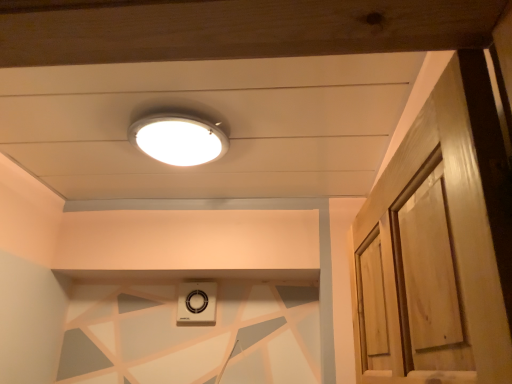
What do you see at coordinates (178, 139) in the screenshot? I see `white glossy lamp at upper center` at bounding box center [178, 139].

Where is `white glossy lamp at upper center`? The height and width of the screenshot is (384, 512). white glossy lamp at upper center is located at coordinates (178, 139).

This screenshot has height=384, width=512. I want to click on white plastic vent at lower center, so click(x=197, y=302).

What do you see at coordinates (197, 302) in the screenshot?
I see `white plastic vent at lower center` at bounding box center [197, 302].

The height and width of the screenshot is (384, 512). What are the coordinates of `white glossy lamp at upper center` in the screenshot? It's located at (178, 139).

Between white plastic vent at lower center and white glossy lamp at upper center, which one appears on the left side from the viewer's perspective?

Positioned to the left is white plastic vent at lower center.

Is the depth of white plastic vent at lower center greater than that of white glossy lamp at upper center?

Yes, white plastic vent at lower center is further from the camera.

Is point (207, 293) positioned in front of point (168, 150)?

No, it is behind (168, 150).

From the image's perspective, is white plastic vent at lower center on top of white glossy lamp at upper center?

No.

From a real-world perspective, which object rests below the other?

white plastic vent at lower center.

Considering the relative sizes of white plastic vent at lower center and white glossy lamp at upper center in the image provided, is white plastic vent at lower center wider than white glossy lamp at upper center?

Incorrect, the width of white plastic vent at lower center does not surpass that of white glossy lamp at upper center.

Is white plastic vent at lower center shorter than white glossy lamp at upper center?

In fact, white plastic vent at lower center may be taller than white glossy lamp at upper center.

Considering the sizes of objects white plastic vent at lower center and white glossy lamp at upper center in the image provided, who is smaller, white plastic vent at lower center or white glossy lamp at upper center?

With smaller size is white plastic vent at lower center.

Would you say white plastic vent at lower center is outside white glossy lamp at upper center?

Yes.

Is white plastic vent at lower center far from white glossy lamp at upper center?

That's not correct — white plastic vent at lower center is a little close to white glossy lamp at upper center.

Is white plastic vent at lower center oriented away from white glossy lamp at upper center?

Answer: No, white plastic vent at lower center's orientation is not away from white glossy lamp at upper center.

How different are the orientations of white plastic vent at lower center and white glossy lamp at upper center in degrees?

0.234 degrees separate the facing orientations of white plastic vent at lower center and white glossy lamp at upper center.

Locate an element on the screen. lamp located above the white plastic vent at lower center (from the image's perspective) is located at coordinates [x=178, y=139].

Is white glossy lamp at upper center to the right of white plastic vent at lower center from the viewer's perspective?

Correct, you'll find white glossy lamp at upper center to the right of white plastic vent at lower center.

Between white glossy lamp at upper center and white plastic vent at lower center, which one is positioned behind?

white plastic vent at lower center is more distant.

Is point (168, 118) closer or farther from the camera than point (202, 301)?

Point (168, 118) is closer to the camera than point (202, 301).

From the image's perspective, between white glossy lamp at upper center and white plastic vent at lower center, who is located below?

From the image's view, white plastic vent at lower center is below.

From a real-world perspective, is white glossy lamp at upper center above or below white plastic vent at lower center?

white glossy lamp at upper center is situated higher than white plastic vent at lower center in the real world.

In terms of width, does white glossy lamp at upper center look wider or thinner when compared to white plastic vent at lower center?

white glossy lamp at upper center is wider than white plastic vent at lower center.

Can you confirm if white glossy lamp at upper center is taller than white plastic vent at lower center?

Incorrect, the height of white glossy lamp at upper center is not larger of that of white plastic vent at lower center.

Considering the relative sizes of white glossy lamp at upper center and white plastic vent at lower center in the image provided, is white glossy lamp at upper center smaller than white plastic vent at lower center?

Actually, white glossy lamp at upper center might be larger than white plastic vent at lower center.

Would you say white glossy lamp at upper center contains white plastic vent at lower center?

→ That's incorrect, white plastic vent at lower center is not inside white glossy lamp at upper center.

Looking at this image, is white glossy lamp at upper center positioned far away from white plastic vent at lower center?

They are positioned close to each other.

Is white glossy lamp at upper center facing away from white plastic vent at lower center?

white glossy lamp at upper center does not have its back to white plastic vent at lower center.

How much distance is there between white glossy lamp at upper center and white plastic vent at lower center?

white glossy lamp at upper center and white plastic vent at lower center are 77.88 centimeters apart from each other.

At what (x,y) coordinates should I click in order to perform the action: click on appliance that appears below the white glossy lamp at upper center (from the image's perspective). Please return your answer as a coordinate pair (x, y). The image size is (512, 384). Looking at the image, I should click on (197, 302).

The height and width of the screenshot is (384, 512). I want to click on lamp in front of the white plastic vent at lower center, so click(178, 139).

In order to click on appliance lying below the white glossy lamp at upper center (from the image's perspective) in this screenshot , I will do `click(197, 302)`.